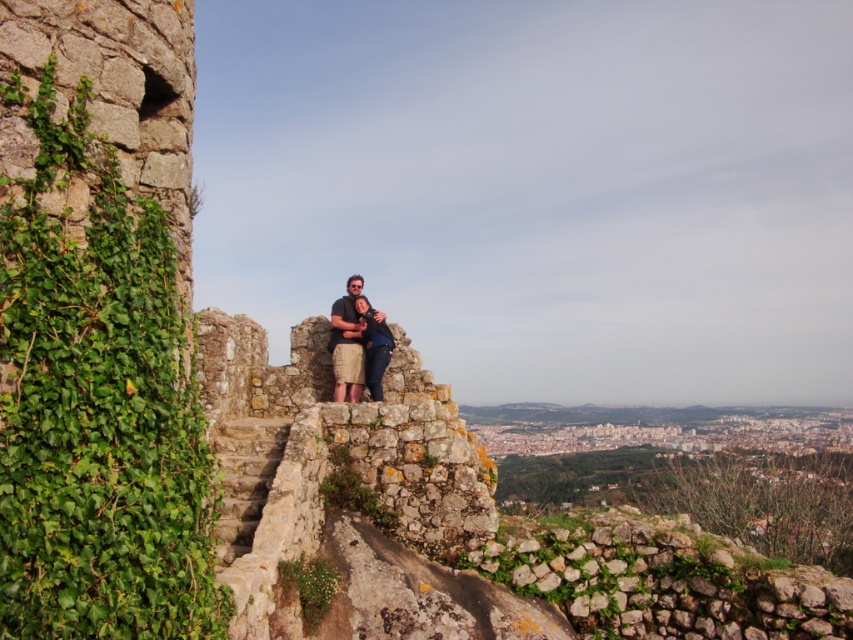
Looking at this image, can you confirm if green leafy ivy at left is positioned below matte khaki shorts at center?

Correct, green leafy ivy at left is located below matte khaki shorts at center.

Measure the distance between green leafy ivy at left and camera.

11.27 meters

Who is more distant from viewer, (45, 396) or (366, 321)?

The point (366, 321) is behind.

Identify the location of green leafy ivy at left. The width and height of the screenshot is (853, 640). (97, 408).

Which is in front, point (383, 365) or point (375, 390)?

Point (375, 390)

Which is behind, point (352, 378) or point (380, 339)?

Positioned behind is point (380, 339).

Identify the location of matte khaki shorts at center. (347, 342).

What do you see at coordinates (97, 408) in the screenshot?
I see `green leafy ivy at left` at bounding box center [97, 408].

Which is above, green leafy ivy at left or denim shorts at center?

denim shorts at center

Is point (189, 576) closer to viewer compared to point (363, 317)?

Yes.

Where is `green leafy ivy at left`? green leafy ivy at left is located at coordinates (97, 408).